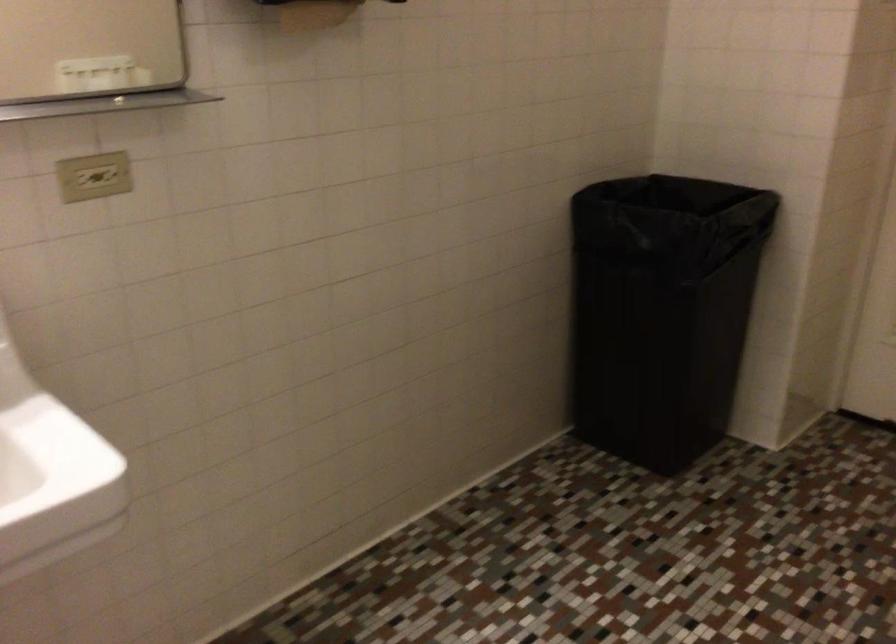
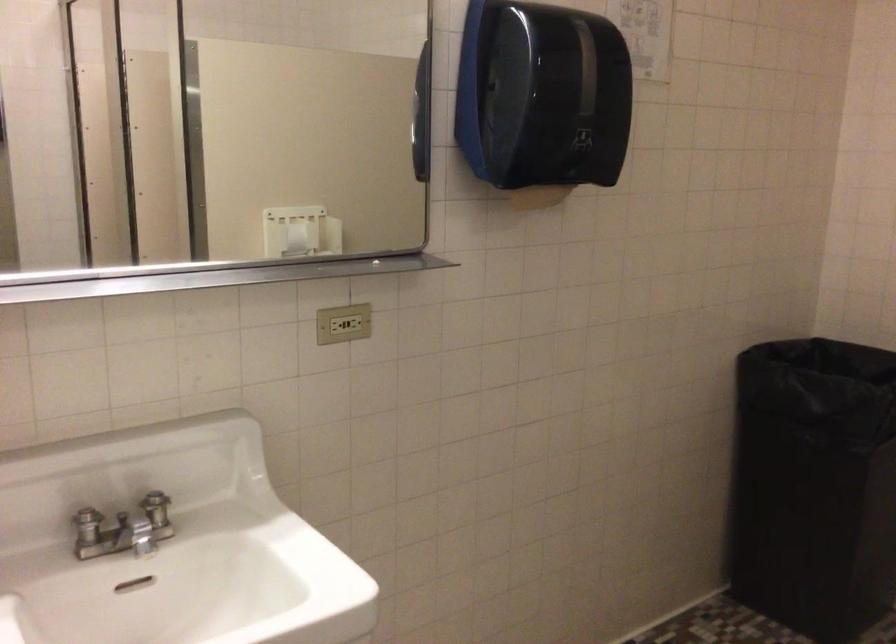
The point at (640, 326) is marked in the first image. Where is the corresponding point in the second image?

(814, 486)